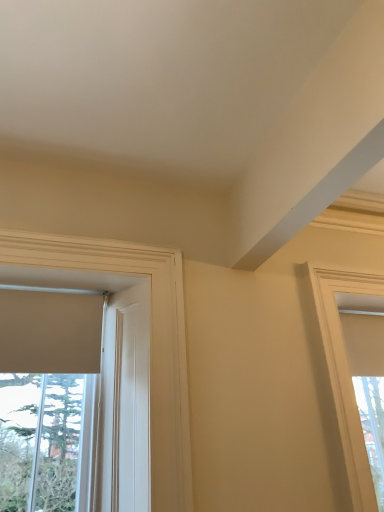
Question: From the image's perspective, is matte white window at right, which ranks as the 2th window in left-to-right order, above white matte window at left, which ranks as the 1th window in left-to-right order?

Choices:
 (A) yes
 (B) no

Answer: (B)

Question: From a real-world perspective, is matte white window at right, the first window when ordered from right to left, beneath white matte window at left, which ranks as the 1th window in left-to-right order?

Choices:
 (A) yes
 (B) no

Answer: (A)

Question: Would you say matte white window at right, which ranks as the 2th window in left-to-right order, is outside white matte window at left, which ranks as the 1th window in left-to-right order?

Choices:
 (A) no
 (B) yes

Answer: (B)

Question: Is matte white window at right, the first window when ordered from right to left, further to the viewer compared to white matte window at left, the 2th window in the right-to-left sequence?

Choices:
 (A) yes
 (B) no

Answer: (A)

Question: Considering the relative sizes of matte white window at right, the first window when ordered from right to left, and white matte window at left, which ranks as the 1th window in left-to-right order, in the image provided, is matte white window at right, the first window when ordered from right to left, thinner than white matte window at left, which ranks as the 1th window in left-to-right order,?

Choices:
 (A) yes
 (B) no

Answer: (A)

Question: Could you tell me if matte white window at right, the first window when ordered from right to left, is facing white matte window at left, which ranks as the 1th window in left-to-right order?

Choices:
 (A) no
 (B) yes

Answer: (A)

Question: Can matte white window at right, which ranks as the 2th window in left-to-right order, be found inside white matte window at left, which ranks as the 1th window in left-to-right order?

Choices:
 (A) yes
 (B) no

Answer: (B)

Question: Is white matte window at left, the 2th window in the right-to-left sequence, taller than matte white window at right, the first window when ordered from right to left?

Choices:
 (A) yes
 (B) no

Answer: (B)

Question: Is white matte window at left, the 2th window in the right-to-left sequence, positioned before matte white window at right, which ranks as the 2th window in left-to-right order?

Choices:
 (A) yes
 (B) no

Answer: (A)

Question: Is white matte window at left, which ranks as the 1th window in left-to-right order, not near matte white window at right, the first window when ordered from right to left?

Choices:
 (A) yes
 (B) no

Answer: (B)

Question: Does white matte window at left, which ranks as the 1th window in left-to-right order, appear on the left side of matte white window at right, the first window when ordered from right to left?

Choices:
 (A) yes
 (B) no

Answer: (A)

Question: Is white matte window at left, the 2th window in the right-to-left sequence, looking in the opposite direction of matte white window at right, the first window when ordered from right to left?

Choices:
 (A) no
 (B) yes

Answer: (A)

Question: From a real-world perspective, is matte white window at right, which ranks as the 2th window in left-to-right order, positioned above or below white matte window at left, which ranks as the 1th window in left-to-right order?

Choices:
 (A) above
 (B) below

Answer: (B)